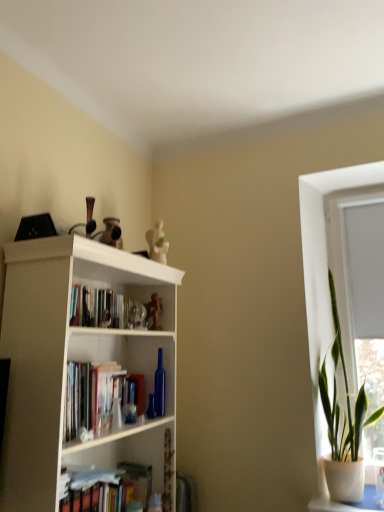
Question: From the image's perspective, is white plastic window frame at upper right over green leafy plant in pot at right?

Choices:
 (A) no
 (B) yes

Answer: (B)

Question: Considering the relative sizes of white plastic window frame at upper right and green leafy plant in pot at right in the image provided, is white plastic window frame at upper right thinner than green leafy plant in pot at right?

Choices:
 (A) no
 (B) yes

Answer: (B)

Question: Does white plastic window frame at upper right have a smaller size compared to green leafy plant in pot at right?

Choices:
 (A) yes
 (B) no

Answer: (A)

Question: Does white plastic window frame at upper right have a larger size compared to green leafy plant in pot at right?

Choices:
 (A) yes
 (B) no

Answer: (B)

Question: Is white plastic window frame at upper right not inside green leafy plant in pot at right?

Choices:
 (A) no
 (B) yes

Answer: (B)

Question: From the image's perspective, is white plastic window frame at upper right located beneath green leafy plant in pot at right?

Choices:
 (A) yes
 (B) no

Answer: (B)

Question: From the image's perspective, is white plastic window frame at upper right on hardcover books at center?

Choices:
 (A) yes
 (B) no

Answer: (A)

Question: Is white plastic window frame at upper right wider than hardcover books at center?

Choices:
 (A) no
 (B) yes

Answer: (A)

Question: Is white plastic window frame at upper right to the right of hardcover books at center from the viewer's perspective?

Choices:
 (A) yes
 (B) no

Answer: (A)

Question: Does white plastic window frame at upper right appear on the left side of hardcover books at center?

Choices:
 (A) yes
 (B) no

Answer: (B)

Question: Is white plastic window frame at upper right not within hardcover books at center?

Choices:
 (A) yes
 (B) no

Answer: (A)

Question: Considering the relative sizes of white plastic window frame at upper right and hardcover books at center in the image provided, is white plastic window frame at upper right taller than hardcover books at center?

Choices:
 (A) no
 (B) yes

Answer: (B)

Question: Considering the relative sizes of green leafy plant in pot at right and white matte bookcase at upper left in the image provided, is green leafy plant in pot at right thinner than white matte bookcase at upper left?

Choices:
 (A) no
 (B) yes

Answer: (B)